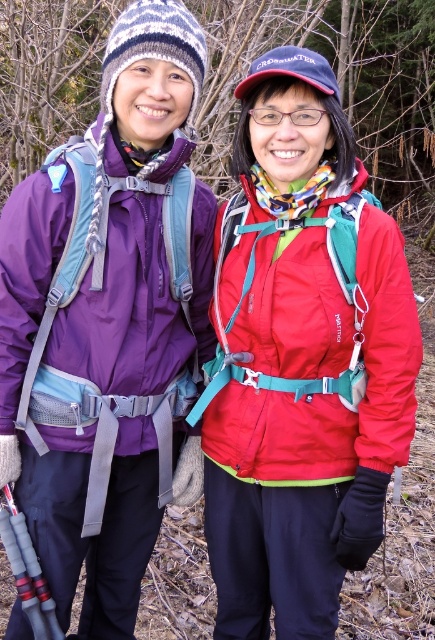
Does matte purple jacket at left have a greater width compared to matte red jacket at center?

Incorrect, matte purple jacket at left's width does not surpass matte red jacket at center's.

This screenshot has width=435, height=640. What do you see at coordinates (103, 308) in the screenshot? I see `matte purple jacket at left` at bounding box center [103, 308].

Locate an element on the screen. Image resolution: width=435 pixels, height=640 pixels. matte purple jacket at left is located at coordinates (103, 308).